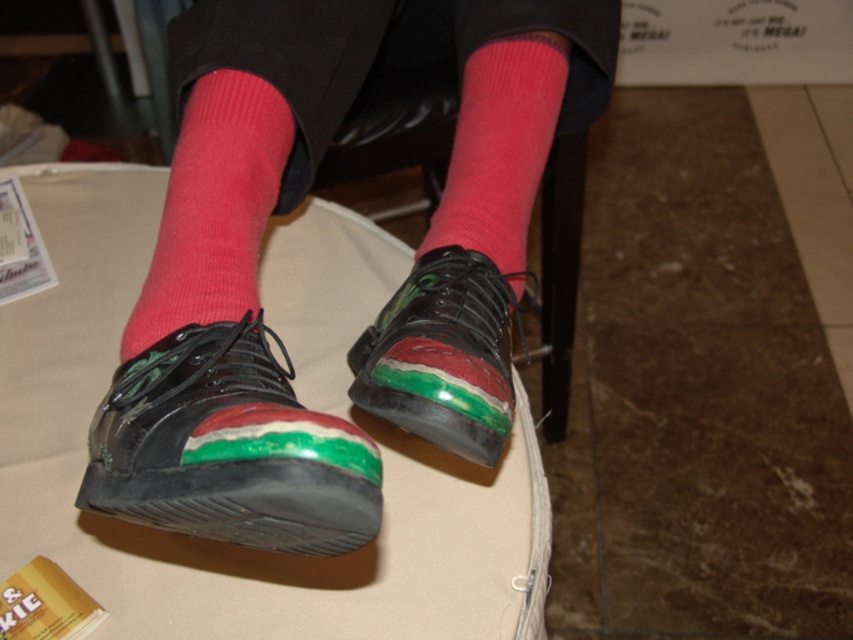
Describe the element at coordinates (229, 449) in the screenshot. This screenshot has width=853, height=640. I see `shiny black shoe at lower center` at that location.

Does point (357, 500) lie in front of point (480, 124)?

Yes.

At what (x,y) coordinates should I click in order to perform the action: click on shiny black shoe at lower center. Please return your answer as a coordinate pair (x, y). Looking at the image, I should click on (229, 449).

Is pink ribbed sock at lower left to the left of green matte shoe at center from the viewer's perspective?

Yes, pink ribbed sock at lower left is to the left of green matte shoe at center.

From the picture: Who is positioned more to the left, pink ribbed sock at lower left or green matte shoe at center?

pink ribbed sock at lower left is more to the left.

This screenshot has width=853, height=640. Describe the element at coordinates (213, 208) in the screenshot. I see `pink ribbed sock at lower left` at that location.

Identify the location of pink ribbed sock at lower left. Image resolution: width=853 pixels, height=640 pixels. (213, 208).

The image size is (853, 640). Describe the element at coordinates (213, 208) in the screenshot. I see `pink ribbed sock at lower left` at that location.

Does pink ribbed sock at lower left have a lesser width compared to pink woolen sock at center?

In fact, pink ribbed sock at lower left might be wider than pink woolen sock at center.

Which is behind, point (228, 260) or point (527, 140)?

Point (527, 140)

The height and width of the screenshot is (640, 853). In order to click on pink ribbed sock at lower left in this screenshot , I will do `click(213, 208)`.